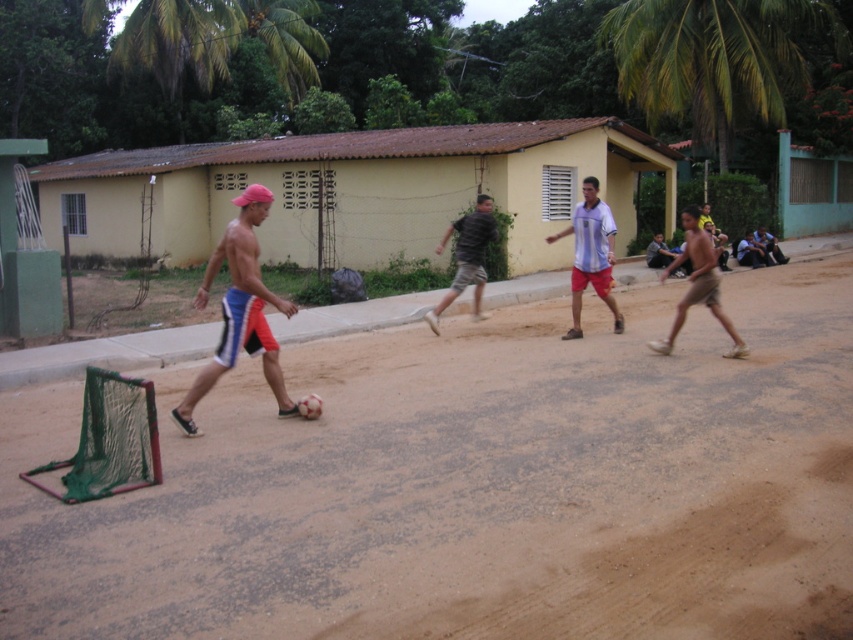
Question: Which object appears farthest from the camera in this image?

Choices:
 (A) green leafy palm tree at upper right
 (B) shiny blue shorts at center

Answer: (A)

Question: Observing the image, what is the correct spatial positioning of green leafy palm tree at upper right in reference to brown cotton shorts at right?

Choices:
 (A) left
 (B) right

Answer: (B)

Question: Which object appears farthest from the camera in this image?

Choices:
 (A) camouflage fabric shirt at center
 (B) green leafy palm tree at upper right

Answer: (B)

Question: Does yellow matte building at center have a smaller size compared to brown cotton shorts at right?

Choices:
 (A) yes
 (B) no

Answer: (B)

Question: Is brown sandy ground at center below yellow matte building at center?

Choices:
 (A) no
 (B) yes

Answer: (B)

Question: Which object is closer to the camera taking this photo?

Choices:
 (A) green leafy palm tree at upper right
 (B) brown sandy ground at center

Answer: (B)